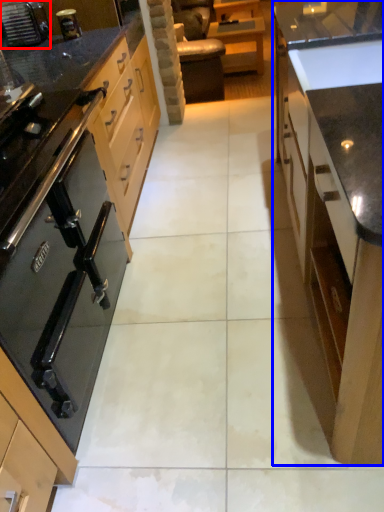
Question: Which of the following is the farthest to the observer, home appliance (highlighted by a red box) or cabinetry (highlighted by a blue box)?

Choices:
 (A) home appliance
 (B) cabinetry

Answer: (A)